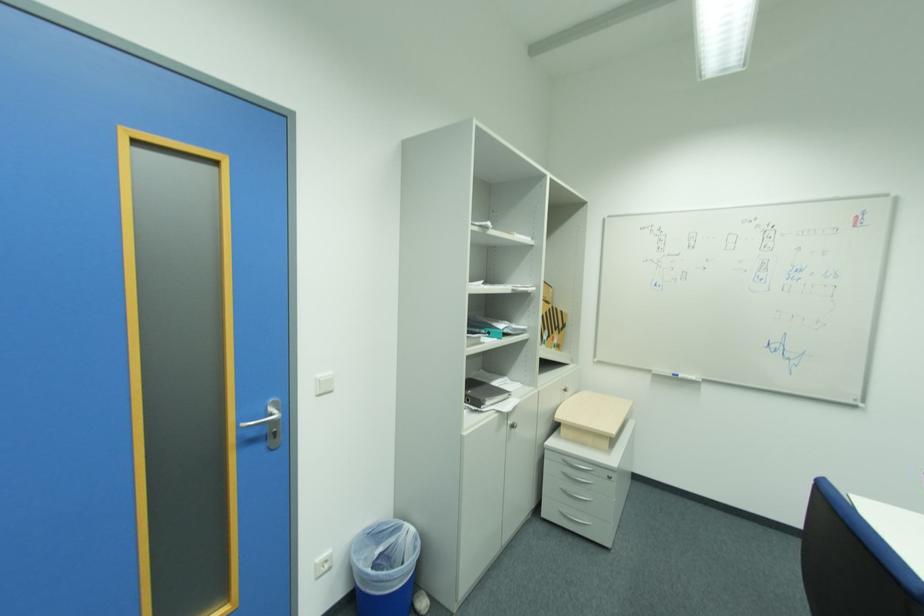
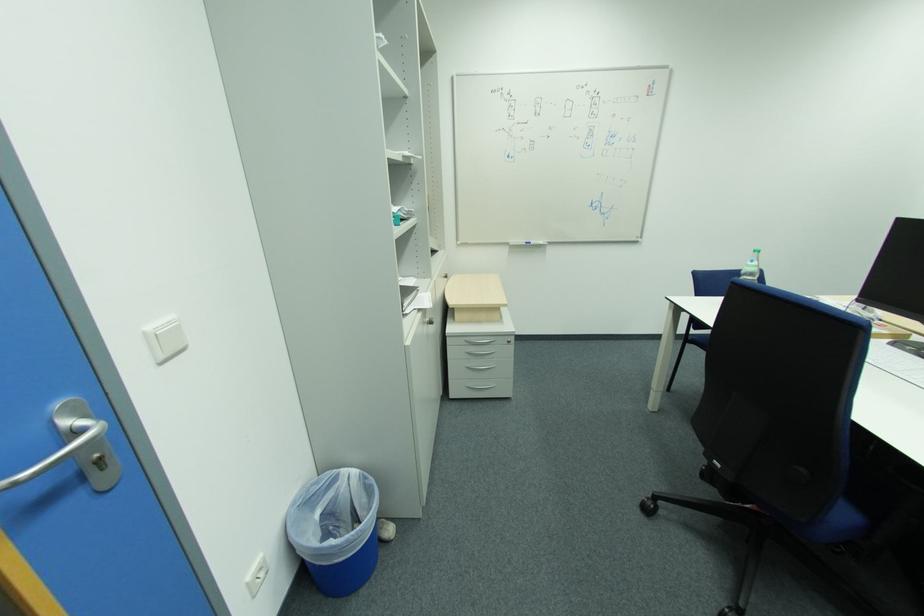
The point at (x=568, y=461) is marked in the first image. Where is the corresponding point in the second image?

(471, 342)